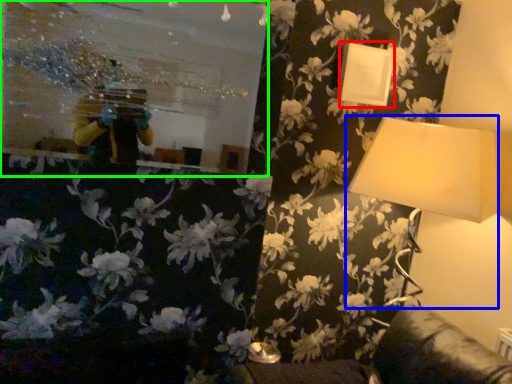
Question: Estimate the real-world distances between objects in this image. Which object is farther from picture frame (highlighted by a red box), lamp (highlighted by a blue box) or mirror (highlighted by a green box)?

Choices:
 (A) lamp
 (B) mirror

Answer: (B)